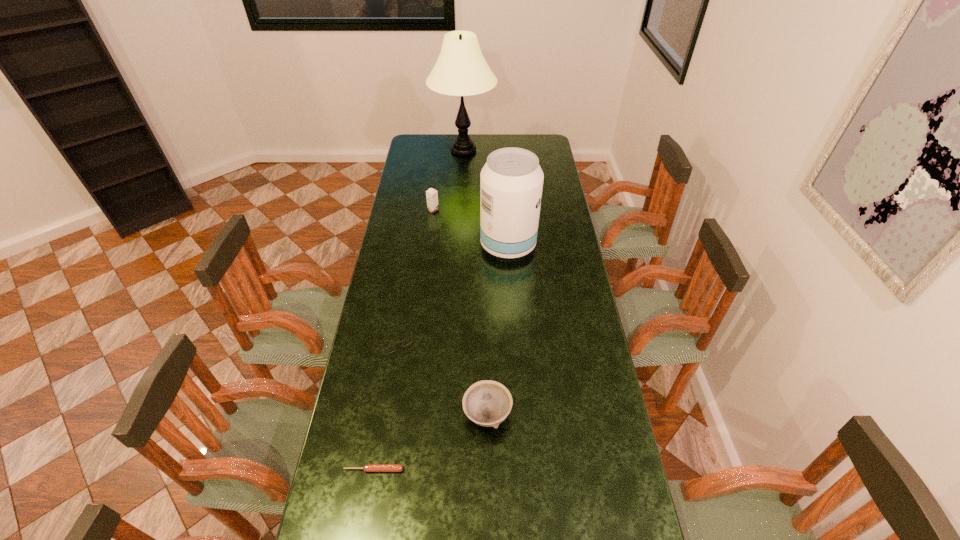
Locate an element on the screen. This screenshot has height=540, width=960. free location that satisfies the following two spatial constraints: 1. with the lenses facing outward on the shortest object; 2. on the left side of the fourth farthest object is located at coordinates (373, 470).

At what (x,y) coordinates should I click in order to perform the action: click on blank space that satisfies the following two spatial constraints: 1. on the back side of the fifth farthest object; 2. on the right side of the sausage. Please return your answer as a coordinate pair (x, y). The width and height of the screenshot is (960, 540). Looking at the image, I should click on (383, 414).

This screenshot has height=540, width=960. I want to click on free spot that satisfies the following two spatial constraints: 1. with the lenses facing outward on the fourth farthest object; 2. on the right side of the fourth tallest object, so click(382, 414).

Identify the location of vacant space that satisfies the following two spatial constraints: 1. on the back side of the fifth nearest object; 2. on the left side of the nearest object. Image resolution: width=960 pixels, height=540 pixels. (418, 210).

The image size is (960, 540). Find the location of `free spot that satisfies the following two spatial constraints: 1. on the front side of the second nearest object; 2. on the left side of the chocolate milk`. free spot that satisfies the following two spatial constraints: 1. on the front side of the second nearest object; 2. on the left side of the chocolate milk is located at coordinates (408, 414).

Where is `vacant space that satisfies the following two spatial constraints: 1. on the back side of the bowl; 2. on the right side of the fifth shortest object`? The height and width of the screenshot is (540, 960). vacant space that satisfies the following two spatial constraints: 1. on the back side of the bowl; 2. on the right side of the fifth shortest object is located at coordinates (485, 246).

You are a GUI agent. You are given a task and a screenshot of the screen. Output one action in this format:
    pyautogui.click(x=<x>, y=<y>)
    Task: Click on the free space that satisfies the following two spatial constraints: 1. with the lenses facing outward on the bowl; 2. on the right side of the fourth farthest object
    The height and width of the screenshot is (540, 960).
    Given the screenshot: What is the action you would take?
    pyautogui.click(x=382, y=414)